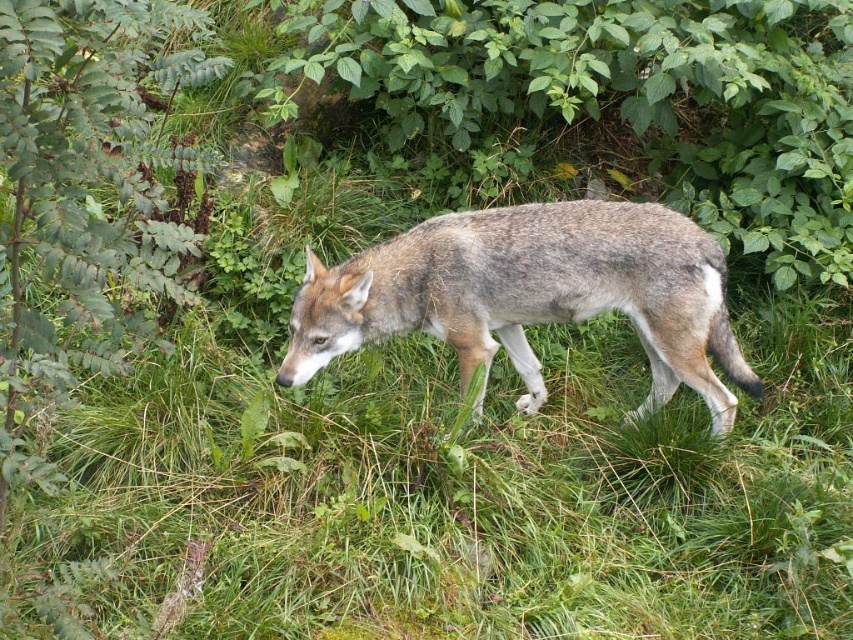
Is green leafy bush at left below gray fur wolf at center?

Actually, green leafy bush at left is above gray fur wolf at center.

Image resolution: width=853 pixels, height=640 pixels. Identify the location of green leafy bush at left. (83, 192).